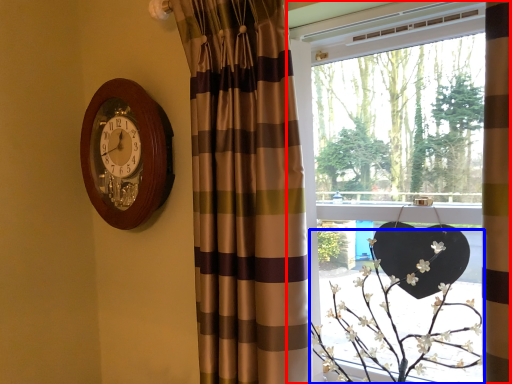
Question: Which object is closer to the camera taking this photo, window (highlighted by a red box) or floral arrangement (highlighted by a blue box)?

Choices:
 (A) window
 (B) floral arrangement

Answer: (A)